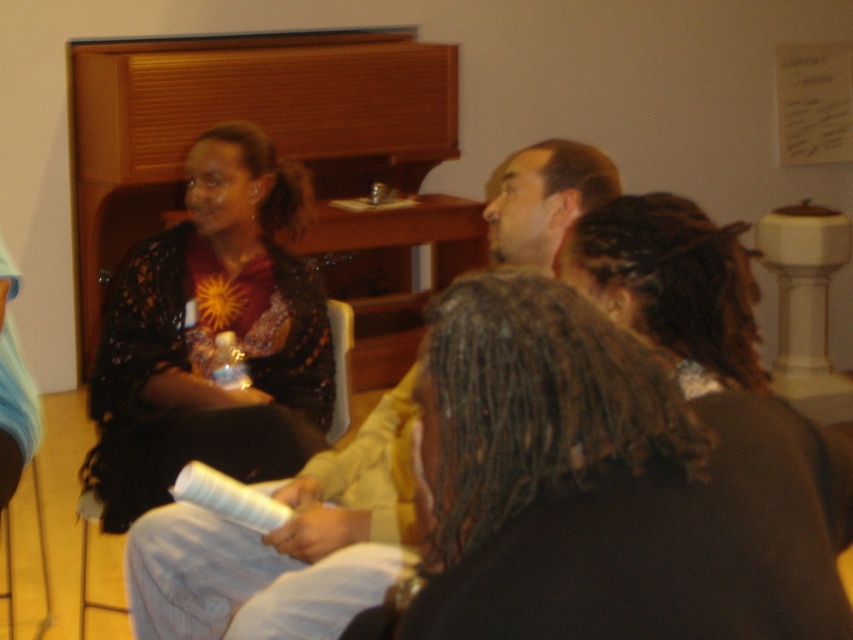
Is dark brown dreadlocks at center bigger than matte black dress at left?

No, dark brown dreadlocks at center is not bigger than matte black dress at left.

Which is in front, point (654, 472) or point (213, 125)?

Point (654, 472) is more forward.

Which is behind, point (820, 604) or point (158, 486)?

The point (158, 486) is more distant.

At what (x,y) coordinates should I click in order to perform the action: click on dark brown dreadlocks at center. Please return your answer as a coordinate pair (x, y). Looking at the image, I should click on (607, 486).

Can you confirm if dark brown dreadlocks at center is taller than matte black shirt at upper center?

Incorrect, dark brown dreadlocks at center's height is not larger of matte black shirt at upper center's.

Is dark brown dreadlocks at center positioned in front of matte black shirt at upper center?

Yes, it is in front of matte black shirt at upper center.

Image resolution: width=853 pixels, height=640 pixels. Describe the element at coordinates (607, 486) in the screenshot. I see `dark brown dreadlocks at center` at that location.

Find the location of a particular element. Image resolution: width=853 pixels, height=640 pixels. dark brown dreadlocks at center is located at coordinates (607, 486).

Can you confirm if matte black dress at left is thinner than matte black shirt at upper center?

No, matte black dress at left is not thinner than matte black shirt at upper center.

Can you confirm if matte black dress at left is shorter than matte black shirt at upper center?

No.

The height and width of the screenshot is (640, 853). What are the coordinates of `matte black dress at left` in the screenshot? It's located at (212, 336).